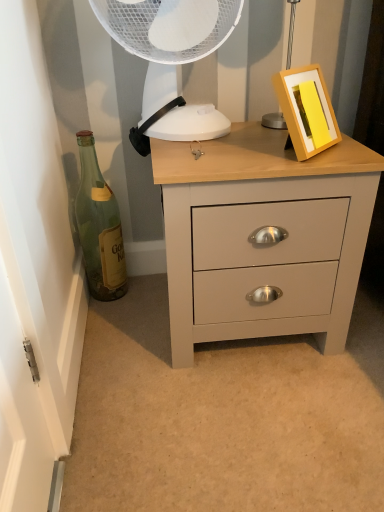
Identify the location of vacant region above matte gray chest of drawers at center (from a real-world perspective). (232, 144).